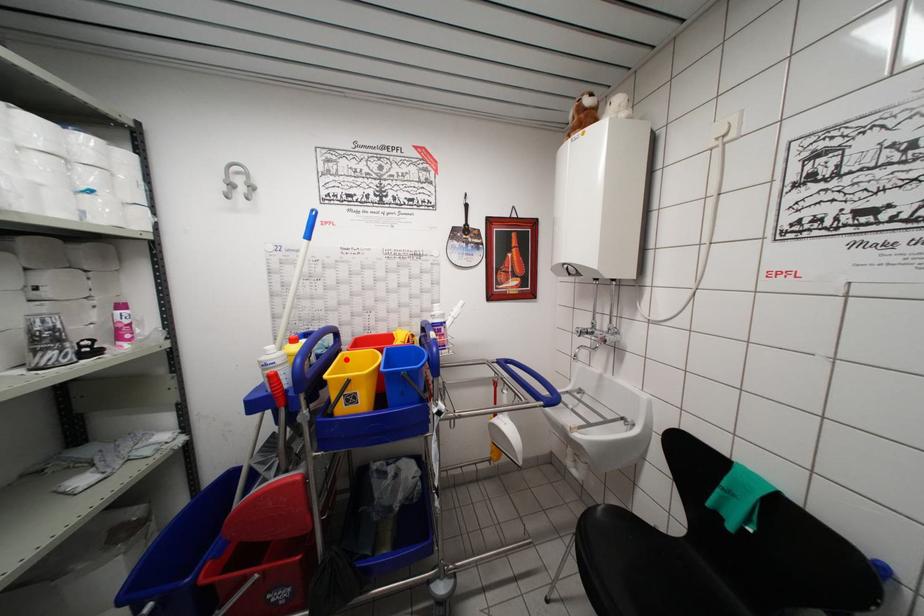
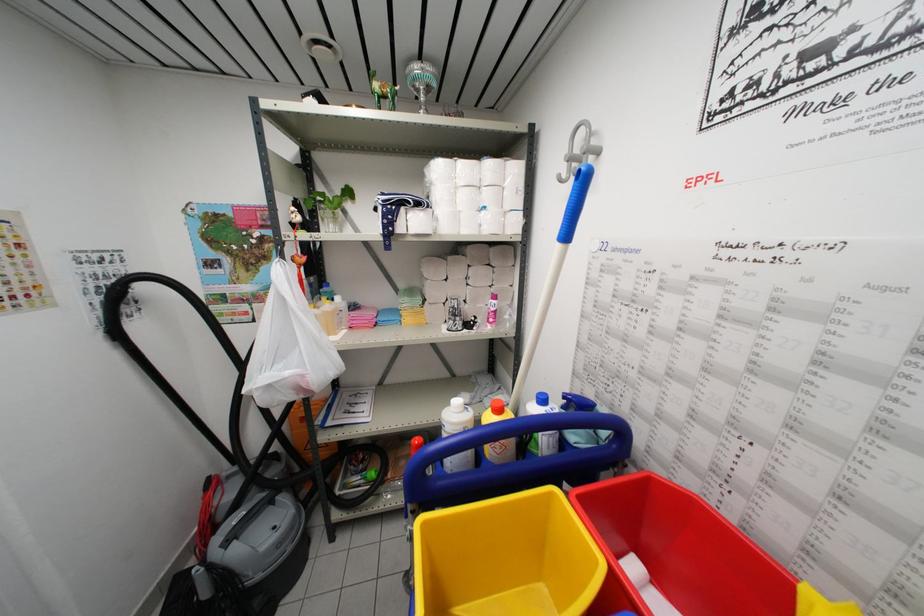
Question: I am providing you with two images of the same scene from different viewpoints. A red point is marked on the first image. Is the red point's position out of view in image 2?

Choices:
 (A) Yes
 (B) No

Answer: (B)